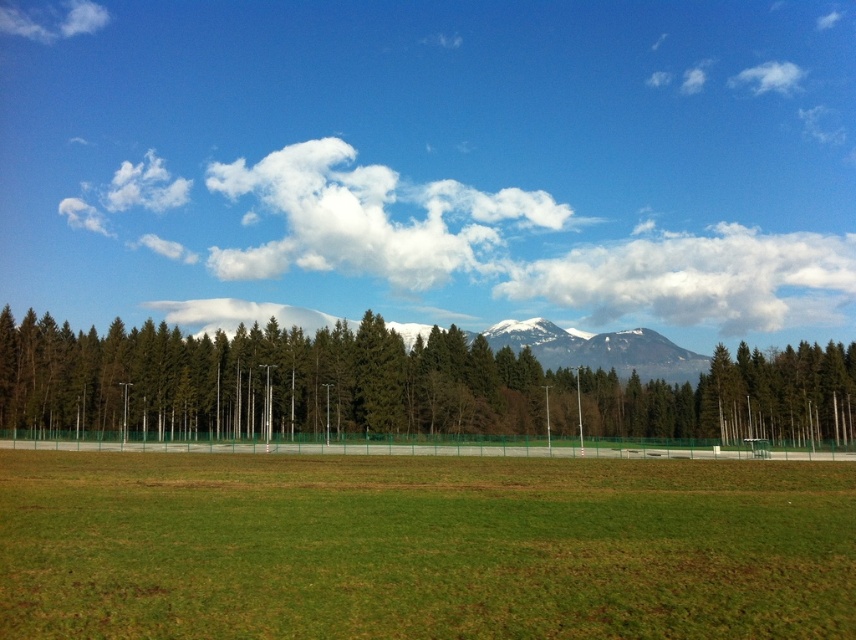
You are standing on the sports field and looking up at the sky. You notice two clouds, the white fluffy cloud at upper center and the white fluffy cloud at upper left. Which cloud is closer to the horizon?

The white fluffy cloud at upper center is closer to the horizon because it is located below the white fluffy cloud at upper left, meaning it is lower in the sky and nearer to the ground level where the horizon is.

You are a gardener planning to mow the green grass field at center and trim the green textured trees at center. Which task should you complete first based on their heights?

The green grass field at center is shorter than the green textured trees at center, so you should mow the green grass field at center first before trimming the taller trees.

You are an architect designing a new park layout. You need to place a new water fountain exactly at the center of the field. However, you must ensure that the fountain does not block the view of the white fluffy cloud at upper center from any point along the fence poles. Given the coordinates provided, can you determine if placing the fountain at the field center will block the view of the cloud?

The white fluffy cloud at upper center is located at coordinates approximately 0.436 on the x and 0.817 on the y axis. Since the fountain is placed at the field center, which is likely near the geometric center of the field, and the cloud is positioned at upper center, the fountain would not block the view of the cloud from the fence poles as the cloud is above and centered, so the fountain placement should be safe.